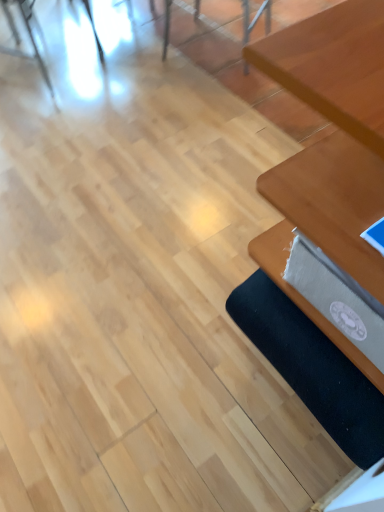
What is the approximate width of wooden table at right?

The width of wooden table at right is 21.44 inches.

What do you see at coordinates (327, 223) in the screenshot? Image resolution: width=384 pixels, height=512 pixels. I see `wooden table at right` at bounding box center [327, 223].

What do you see at coordinates (255, 18) in the screenshot?
I see `wooden chair at upper center, which is counted as the 2th chair, starting from the left` at bounding box center [255, 18].

Locate an element on the screen. The height and width of the screenshot is (512, 384). metallic silver chair at upper left, which is the second chair from right to left is located at coordinates (28, 34).

Is black fabric yoga mat at lower right spatially inside metallic silver chair at upper left, which is the second chair from right to left, or outside of it?

black fabric yoga mat at lower right exists outside the volume of metallic silver chair at upper left, which is the second chair from right to left.

Considering the relative sizes of black fabric yoga mat at lower right and metallic silver chair at upper left, which is the second chair from right to left, in the image provided, is black fabric yoga mat at lower right taller than metallic silver chair at upper left, which is the second chair from right to left,?

No.

Which is more to the left, black fabric yoga mat at lower right or metallic silver chair at upper left, which is the second chair from right to left?

Positioned to the left is metallic silver chair at upper left, which is the second chair from right to left.

Locate an element on the screen. The image size is (384, 512). chair that is the 1st object located above the black fabric yoga mat at lower right (from the image's perspective) is located at coordinates (28, 34).

Is metallic silver chair at upper left, which is the second chair from right to left, far from wooden table at right?

metallic silver chair at upper left, which is the second chair from right to left, is far away from wooden table at right.

Is metallic silver chair at upper left, which is the 1th chair from left to right, facing towards wooden table at right?

No, metallic silver chair at upper left, which is the 1th chair from left to right, is not facing towards wooden table at right.

Considering the relative positions of metallic silver chair at upper left, which is the second chair from right to left, and wooden table at right in the image provided, is metallic silver chair at upper left, which is the second chair from right to left, to the right of wooden table at right from the viewer's perspective?

No.

Considering the sizes of objects metallic silver chair at upper left, which is the 1th chair from left to right, and wooden table at right in the image provided, who is wider, metallic silver chair at upper left, which is the 1th chair from left to right, or wooden table at right?

wooden table at right is wider.

From the image's perspective, is wooden table at right on top of metallic silver chair at upper left, which is the 1th chair from left to right?

No, from the image's perspective, wooden table at right is not on top of metallic silver chair at upper left, which is the 1th chair from left to right.

Does wooden table at right lie behind metallic silver chair at upper left, which is the 1th chair from left to right?

That is False.

Is wooden table at right at the right side of metallic silver chair at upper left, which is the 1th chair from left to right?

Correct, you'll find wooden table at right to the right of metallic silver chair at upper left, which is the 1th chair from left to right.

Does point (244, 44) come closer to viewer compared to point (6, 11)?

That is True.

From the image's perspective, which object appears higher, wooden chair at upper center, which ranks as the first chair in right-to-left order, or metallic silver chair at upper left, which is the 1th chair from left to right?

From the image's view, wooden chair at upper center, which ranks as the first chair in right-to-left order, is above.

How many degrees apart are the facing directions of wooden chair at upper center, which ranks as the first chair in right-to-left order, and metallic silver chair at upper left, which is the second chair from right to left?

The angular difference between wooden chair at upper center, which ranks as the first chair in right-to-left order, and metallic silver chair at upper left, which is the second chair from right to left, is 93.4 degrees.

Between wooden chair at upper center, which is counted as the 2th chair, starting from the left, and metallic silver chair at upper left, which is the 1th chair from left to right, which one has less height?

With less height is wooden chair at upper center, which is counted as the 2th chair, starting from the left.

In the scene shown: Is metallic silver chair at upper left, which is the 1th chair from left to right, closer to the viewer compared to wooden chair at upper center, which is counted as the 2th chair, starting from the left?

Yes, it is.

Which object is wider, metallic silver chair at upper left, which is the 1th chair from left to right, or wooden chair at upper center, which is counted as the 2th chair, starting from the left?

wooden chair at upper center, which is counted as the 2th chair, starting from the left, is wider.

Considering the relative positions of metallic silver chair at upper left, which is the second chair from right to left, and wooden chair at upper center, which is counted as the 2th chair, starting from the left, in the image provided, is metallic silver chair at upper left, which is the second chair from right to left, to the right of wooden chair at upper center, which is counted as the 2th chair, starting from the left, from the viewer's perspective?

No.

How many degrees apart are the facing directions of metallic silver chair at upper left, which is the second chair from right to left, and wooden chair at upper center, which ranks as the first chair in right-to-left order?

93.4 degrees.

In the scene shown: From the image's perspective, relative to black fabric yoga mat at lower right, is wooden chair at upper center, which ranks as the first chair in right-to-left order, above or below?

From the image's perspective, wooden chair at upper center, which ranks as the first chair in right-to-left order, appears above black fabric yoga mat at lower right.

Which is behind, wooden chair at upper center, which is counted as the 2th chair, starting from the left, or black fabric yoga mat at lower right?

wooden chair at upper center, which is counted as the 2th chair, starting from the left, is behind.

Which is more to the right, wooden chair at upper center, which is counted as the 2th chair, starting from the left, or black fabric yoga mat at lower right?

From the viewer's perspective, black fabric yoga mat at lower right appears more on the right side.

Which is further, (246, 23) or (383, 445)?

The point (246, 23) is farther.

Considering the positions of objects wooden table at right and wooden chair at upper center, which is counted as the 2th chair, starting from the left, in the image provided, who is in front, wooden table at right or wooden chair at upper center, which is counted as the 2th chair, starting from the left,?

wooden table at right is more forward.

Is wooden table at right turned away from wooden chair at upper center, which ranks as the first chair in right-to-left order?

No, wooden chair at upper center, which ranks as the first chair in right-to-left order, is not at the back of wooden table at right.

Can you confirm if wooden table at right is thinner than wooden chair at upper center, which is counted as the 2th chair, starting from the left?

No.

Are wooden table at right and wooden chair at upper center, which is counted as the 2th chair, starting from the left, making contact?

They are not placed beside each other.

The height and width of the screenshot is (512, 384). Find the location of `the 1st chair above the black fabric yoga mat at lower right (from the image's perspective)`. the 1st chair above the black fabric yoga mat at lower right (from the image's perspective) is located at coordinates (28, 34).

What are the coordinates of `table on the right of metallic silver chair at upper left, which is the 1th chair from left to right` in the screenshot? It's located at (327, 223).

When comparing their distances from wooden table at right, does wooden chair at upper center, which ranks as the first chair in right-to-left order, or metallic silver chair at upper left, which is the 1th chair from left to right, seem further?

metallic silver chair at upper left, which is the 1th chair from left to right, lies further to wooden table at right than the other object.

Based on their spatial positions, is metallic silver chair at upper left, which is the second chair from right to left, or wooden chair at upper center, which ranks as the first chair in right-to-left order, further from black fabric yoga mat at lower right?

Among the two, metallic silver chair at upper left, which is the second chair from right to left, is located further to black fabric yoga mat at lower right.

Looking at the image, which one is located further to black fabric yoga mat at lower right, wooden chair at upper center, which is counted as the 2th chair, starting from the left, or metallic silver chair at upper left, which is the second chair from right to left?

metallic silver chair at upper left, which is the second chair from right to left, lies further to black fabric yoga mat at lower right than the other object.

Considering their positions, is metallic silver chair at upper left, which is the second chair from right to left, positioned further to wooden table at right than wooden chair at upper center, which ranks as the first chair in right-to-left order?

metallic silver chair at upper left, which is the second chair from right to left, lies further to wooden table at right than the other object.

Which object lies further to the anchor point black fabric yoga mat at lower right, metallic silver chair at upper left, which is the 1th chair from left to right, or wooden table at right?

metallic silver chair at upper left, which is the 1th chair from left to right, is further to black fabric yoga mat at lower right.

Which object lies further to the anchor point wooden chair at upper center, which is counted as the 2th chair, starting from the left, wooden table at right or black fabric yoga mat at lower right?

Based on the image, black fabric yoga mat at lower right appears to be further to wooden chair at upper center, which is counted as the 2th chair, starting from the left.

From the image, which object appears to be farther from metallic silver chair at upper left, which is the second chair from right to left, wooden chair at upper center, which ranks as the first chair in right-to-left order, or black fabric yoga mat at lower right?

Based on the image, black fabric yoga mat at lower right appears to be further to metallic silver chair at upper left, which is the second chair from right to left.

Considering their positions, is black fabric yoga mat at lower right positioned further to wooden table at right than wooden chair at upper center, which ranks as the first chair in right-to-left order?

The object further to wooden table at right is wooden chair at upper center, which ranks as the first chair in right-to-left order.

This screenshot has height=512, width=384. What are the coordinates of `table that lies between metallic silver chair at upper left, which is the second chair from right to left, and black fabric yoga mat at lower right from top to bottom` in the screenshot? It's located at (327, 223).

At what (x,y) coordinates should I click in order to perform the action: click on chair that lies between wooden chair at upper center, which is counted as the 2th chair, starting from the left, and black fabric yoga mat at lower right from top to bottom. Please return your answer as a coordinate pair (x, y). The image size is (384, 512). Looking at the image, I should click on (28, 34).

Locate an element on the screen. table between wooden chair at upper center, which is counted as the 2th chair, starting from the left, and black fabric yoga mat at lower right, in the vertical direction is located at coordinates (327, 223).

You are a GUI agent. You are given a task and a screenshot of the screen. Output one action in this format:
    pyautogui.click(x=<x>, y=<y>)
    Task: Click on the chair located between wooden table at right and wooden chair at upper center, which ranks as the first chair in right-to-left order, in the depth direction
    This screenshot has width=384, height=512.
    Given the screenshot: What is the action you would take?
    pyautogui.click(x=28, y=34)